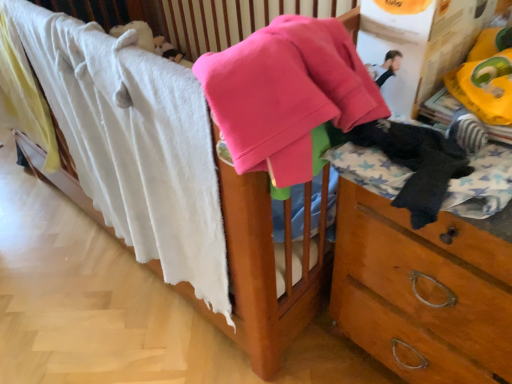
Question: Should I look upward or downward to see pink fleece sweater at upper center?

Choices:
 (A) down
 (B) up

Answer: (B)

Question: Is pink fleece sweater at upper center at the right side of white soft towel at upper left?

Choices:
 (A) yes
 (B) no

Answer: (A)

Question: Can you confirm if pink fleece sweater at upper center is bigger than white soft towel at upper left?

Choices:
 (A) no
 (B) yes

Answer: (A)

Question: From a real-world perspective, is pink fleece sweater at upper center under white soft towel at upper left?

Choices:
 (A) no
 (B) yes

Answer: (A)

Question: Does pink fleece sweater at upper center appear on the left side of white soft towel at upper left?

Choices:
 (A) no
 (B) yes

Answer: (A)

Question: From the image's perspective, would you say pink fleece sweater at upper center is positioned over white soft towel at upper left?

Choices:
 (A) no
 (B) yes

Answer: (B)

Question: Is pink fleece sweater at upper center aimed at white soft towel at upper left?

Choices:
 (A) yes
 (B) no

Answer: (B)

Question: Does black fuzzy socks at right have a greater width compared to white soft towel at upper left?

Choices:
 (A) no
 (B) yes

Answer: (B)

Question: Considering the relative sizes of black fuzzy socks at right and white soft towel at upper left in the image provided, is black fuzzy socks at right smaller than white soft towel at upper left?

Choices:
 (A) yes
 (B) no

Answer: (A)

Question: Is black fuzzy socks at right at the right side of white soft towel at upper left?

Choices:
 (A) no
 (B) yes

Answer: (B)

Question: From the image's perspective, does black fuzzy socks at right appear lower than white soft towel at upper left?

Choices:
 (A) yes
 (B) no

Answer: (A)

Question: From a real-world perspective, is black fuzzy socks at right beneath white soft towel at upper left?

Choices:
 (A) yes
 (B) no

Answer: (B)

Question: Is black fuzzy socks at right placed right next to white soft towel at upper left?

Choices:
 (A) no
 (B) yes

Answer: (A)

Question: Is white soft towel at upper left bigger than black fuzzy socks at right?

Choices:
 (A) yes
 (B) no

Answer: (A)